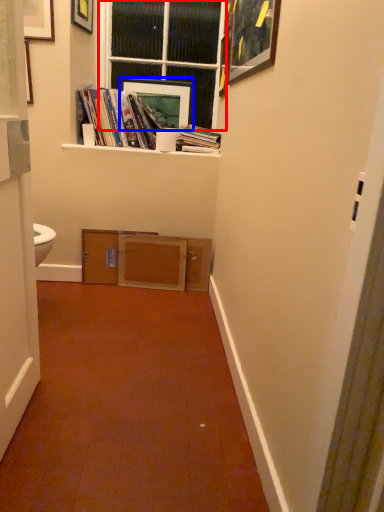
Question: Which object is closer to the camera taking this photo, window (highlighted by a red box) or picture frame (highlighted by a blue box)?

Choices:
 (A) window
 (B) picture frame

Answer: (A)